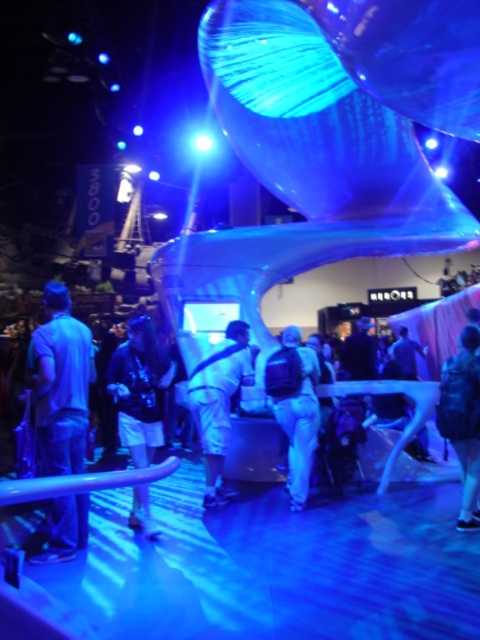
Looking at this image, you are standing in the convention hall and see the denim shorts at center and the leather jacket at lower right. Which item is positioned higher up in the image?

The denim shorts at center is located above the leather jacket at lower right, so it is positioned higher up in the image.